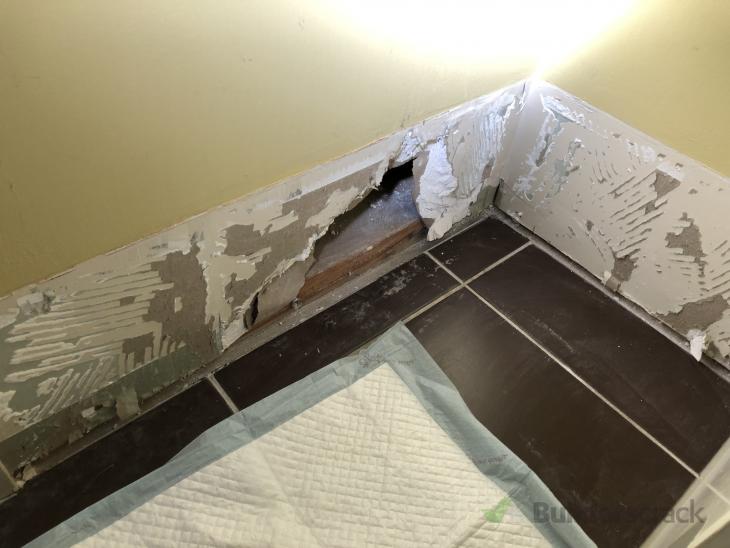
Locate an element on the screen. The image size is (730, 548). plaster is located at coordinates (218, 276), (123, 268).